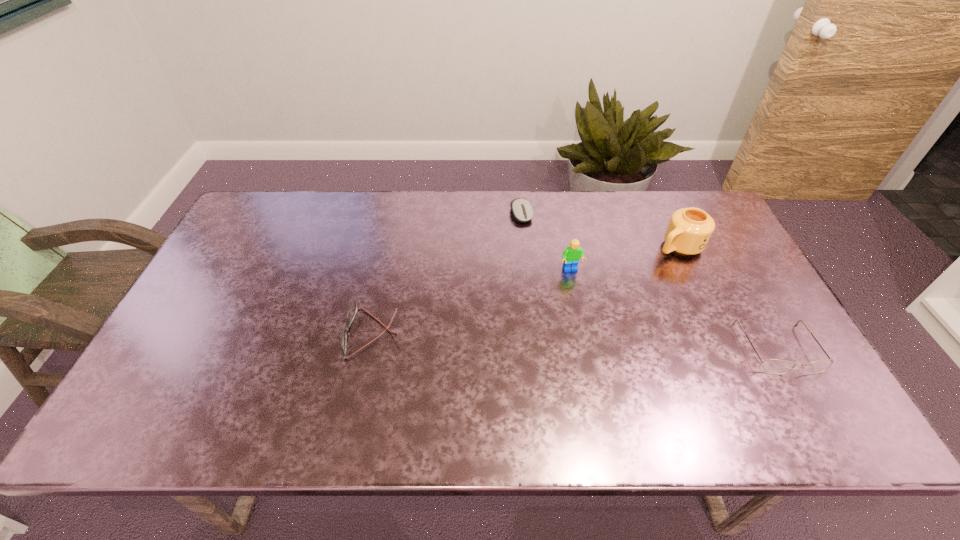
Find the location of a particular element. The image size is (960, 540). free spot on the desktop that is between the leftmost object and the right spectacles and is positioned on the wheel side of the computer equipment is located at coordinates (581, 341).

This screenshot has height=540, width=960. In order to click on free space on the desktop that is between the left spectacles and the right spectacles and is positioned on the handle side of the second farthest object in this screenshot , I will do `click(529, 339)`.

Image resolution: width=960 pixels, height=540 pixels. Find the location of `vacant spot on the desktop that is between the left spectacles and the right spectacles and is positioned on the face of the third object from left to right`. vacant spot on the desktop that is between the left spectacles and the right spectacles and is positioned on the face of the third object from left to right is located at coordinates (601, 342).